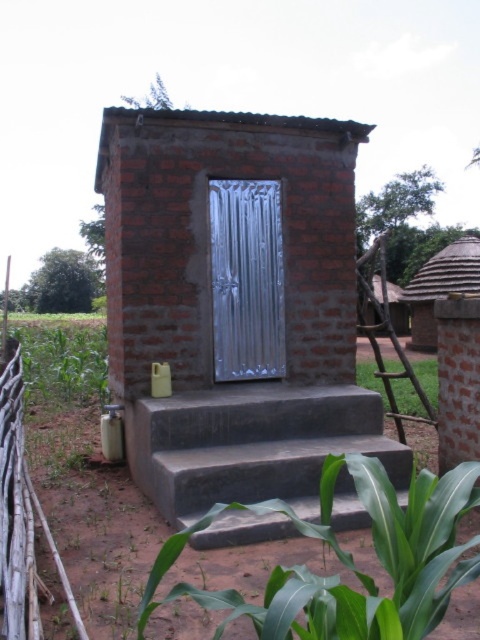
You are a visitor to this rural area and need to determine which object is shorter between the green leafy plant at left and the thatched straw hut at center. Can you identify the shorter one?

The green leafy plant at left is shorter than the thatched straw hut at center according to the description provided.

You are a gardener who needs to water the green leafy plant at left and the thatched straw hut at center. The watering can you have can only carry enough water for one of them. Based on their distance apart, which one should you water first to minimize the walking distance?

The green leafy plant at left and thatched straw hut at center are 10.50 meters apart. To minimize walking distance, you should water the closer one first. However, since the exact distance from your current position to each is not provided, it is impossible to determine which is nearer. Please provide more information about your location relative to both objects.